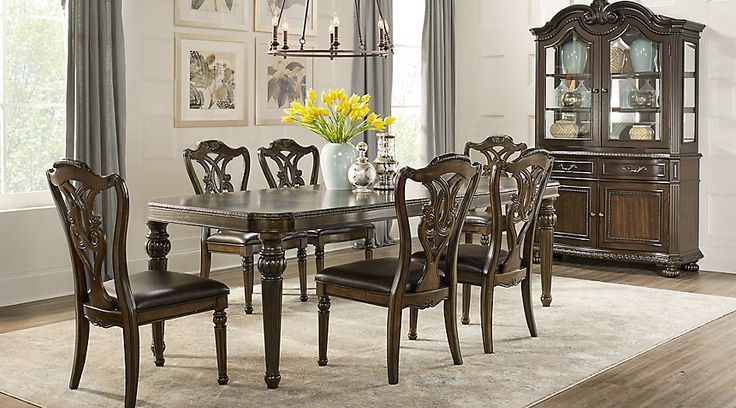
The image size is (736, 408). I want to click on candlesticks, so click(339, 36), click(332, 39), click(378, 34), click(386, 39), click(283, 35), click(276, 35).